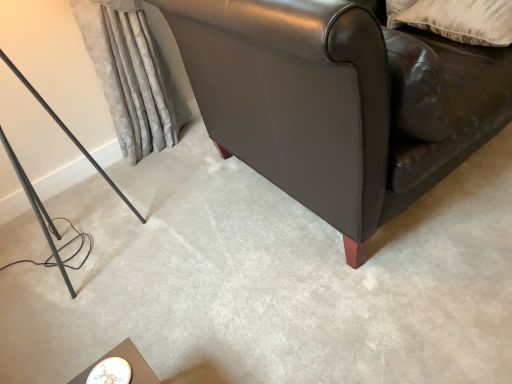
Question: Is beige textured pillow at upper right outside silky gray curtain at left?

Choices:
 (A) no
 (B) yes

Answer: (B)

Question: From the image's perspective, would you say beige textured pillow at upper right is positioned over silky gray curtain at left?

Choices:
 (A) yes
 (B) no

Answer: (A)

Question: Does beige textured pillow at upper right turn towards silky gray curtain at left?

Choices:
 (A) no
 (B) yes

Answer: (A)

Question: Is beige textured pillow at upper right thinner than silky gray curtain at left?

Choices:
 (A) yes
 (B) no

Answer: (B)

Question: Does beige textured pillow at upper right come behind silky gray curtain at left?

Choices:
 (A) yes
 (B) no

Answer: (B)

Question: Can you confirm if beige textured pillow at upper right is positioned to the right of silky gray curtain at left?

Choices:
 (A) no
 (B) yes

Answer: (B)

Question: Is marble top table at lower left far away from leather couch at lower right?

Choices:
 (A) yes
 (B) no

Answer: (B)

Question: Is marble top table at lower left at the left side of leather couch at lower right?

Choices:
 (A) no
 (B) yes

Answer: (B)

Question: Is marble top table at lower left beside leather couch at lower right?

Choices:
 (A) no
 (B) yes

Answer: (A)

Question: Can you confirm if marble top table at lower left is wider than leather couch at lower right?

Choices:
 (A) yes
 (B) no

Answer: (B)

Question: Is marble top table at lower left smaller than leather couch at lower right?

Choices:
 (A) no
 (B) yes

Answer: (B)

Question: Is the depth of marble top table at lower left less than that of leather couch at lower right?

Choices:
 (A) yes
 (B) no

Answer: (B)

Question: Is leather couch at lower right not within matte black leather couch at upper right?

Choices:
 (A) no
 (B) yes

Answer: (B)